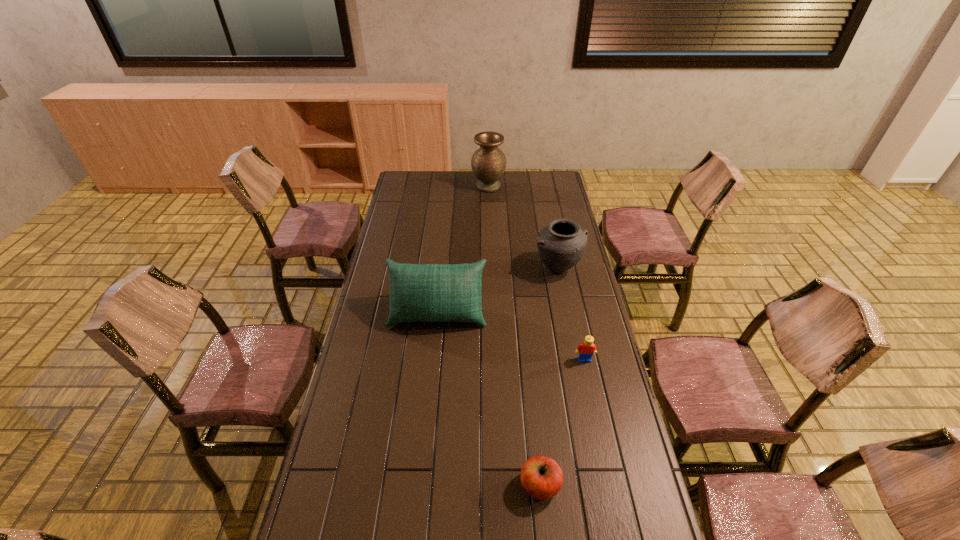
What are the coordinates of `vacant point located between the cushion and the nearest object` in the screenshot? It's located at (489, 399).

Locate an element on the screen. This screenshot has width=960, height=540. free spot between the tallest object and the third nearest object is located at coordinates (463, 249).

Identify the location of free area in between the apple and the cushion. The image size is (960, 540). (489, 399).

Locate an element on the screen. This screenshot has width=960, height=540. free space between the fourth farthest object and the tallest object is located at coordinates (537, 273).

The height and width of the screenshot is (540, 960). Find the location of `vacant area that lies between the apple and the farthest object`. vacant area that lies between the apple and the farthest object is located at coordinates (515, 336).

Where is `unoccupied area between the farthest object and the Lego`? unoccupied area between the farthest object and the Lego is located at coordinates (537, 273).

Choose which object is the third nearest neighbor to the second nearest object. Please provide its 2D coordinates. Your answer should be formatted as a tuple, i.e. [(x, y)], where the tuple contains the x and y coordinates of a point satisfying the conditions above.

[(541, 477)]

Locate which object ranks fourth in proximity to the fourth nearest object. Please provide its 2D coordinates. Your answer should be formatted as a tuple, i.e. [(x, y)], where the tuple contains the x and y coordinates of a point satisfying the conditions above.

[(541, 477)]

Find the location of a particular element. This screenshot has height=540, width=960. vacant space that satisfies the following two spatial constraints: 1. on the front-facing side of the third farthest object; 2. on the right side of the nearest object is located at coordinates (420, 486).